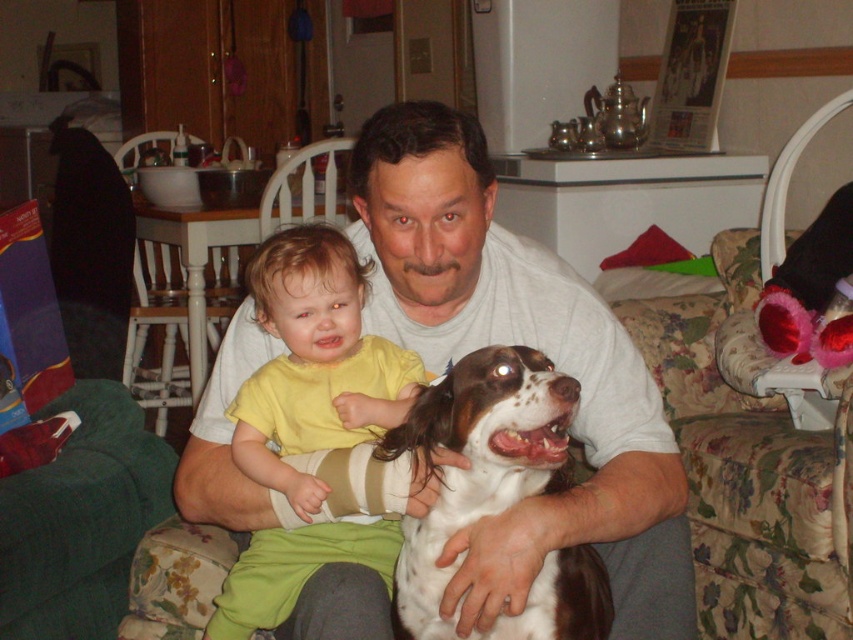
Question: In this image, where is white cotton shirt at center located relative to yellow matte shirt at center?

Choices:
 (A) left
 (B) right

Answer: (B)

Question: Which point is closer to the camera taking this photo?

Choices:
 (A) (424, 324)
 (B) (605, 628)
 (C) (279, 307)

Answer: (B)

Question: Is white cotton shirt at center to the right of yellow matte shirt at center from the viewer's perspective?

Choices:
 (A) yes
 (B) no

Answer: (A)

Question: Which object is positioned farthest from the white cotton shirt at center?

Choices:
 (A) yellow matte shirt at center
 (B) white speckled fur dog at center

Answer: (A)

Question: Which point appears closest to the camera in this image?

Choices:
 (A) (332, 240)
 (B) (427, 154)

Answer: (B)

Question: Considering the relative positions of white cotton shirt at center and yellow matte shirt at center in the image provided, where is white cotton shirt at center located with respect to yellow matte shirt at center?

Choices:
 (A) below
 (B) above

Answer: (A)